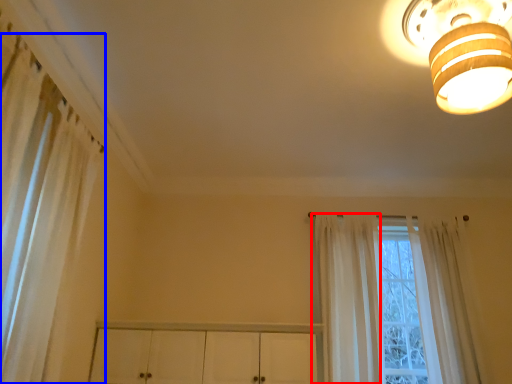
Question: Which point is closer to the camera, curtain (highlighted by a red box) or curtain (highlighted by a blue box)?

Choices:
 (A) curtain
 (B) curtain

Answer: (B)